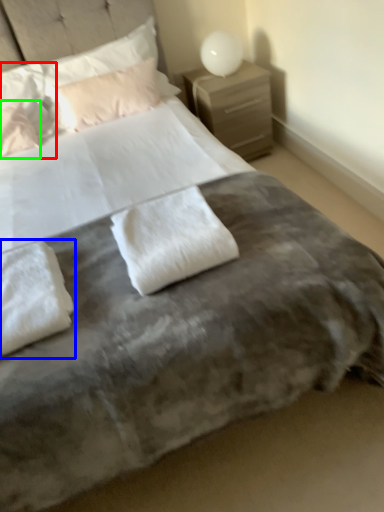
Question: Considering the real-world distances, which object is closest to pillow (highlighted by a red box)? pillow (highlighted by a blue box) or pillow (highlighted by a green box).

Choices:
 (A) pillow
 (B) pillow

Answer: (B)